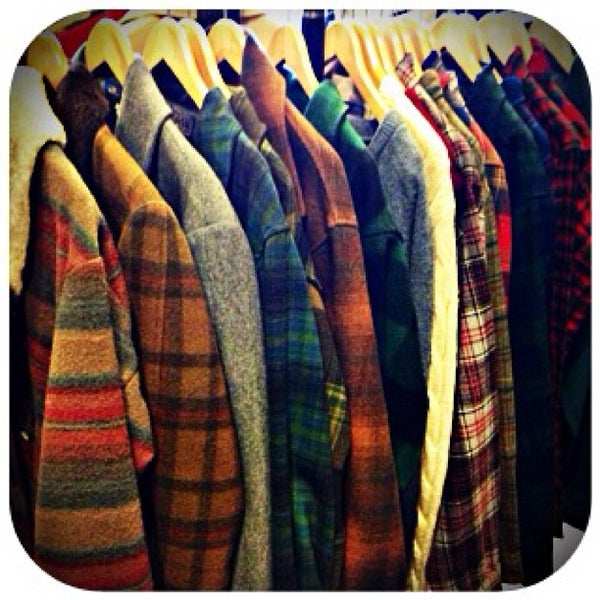
In order to click on cloth hanger in this screenshot , I will do `click(46, 56)`.